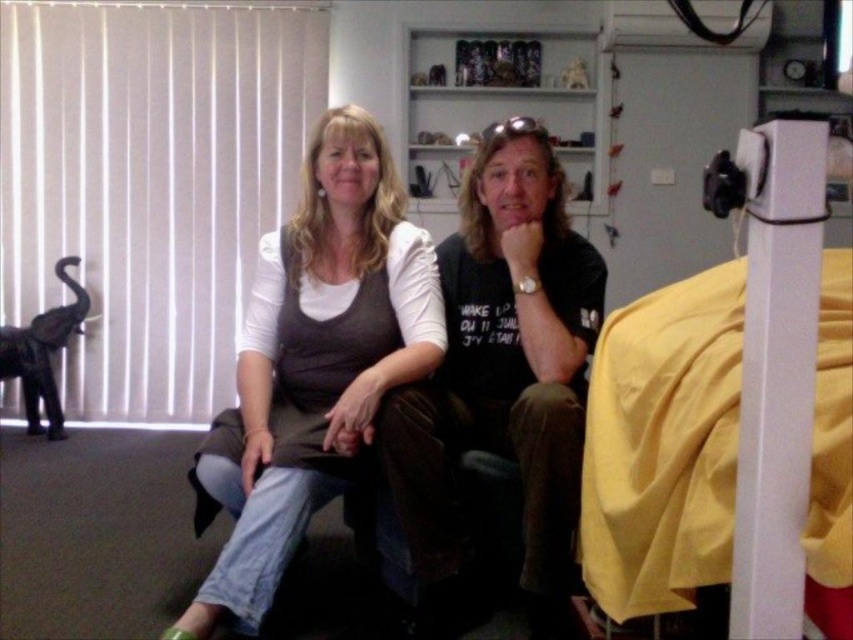
Question: Is matte gray sweater at center positioned behind matte black t-shirt at center?

Choices:
 (A) no
 (B) yes

Answer: (A)

Question: Among these points, which one is nearest to the camera?

Choices:
 (A) (517, 216)
 (B) (711, 161)

Answer: (A)

Question: Can you confirm if yellow fabric bed at right is positioned below matte gray sweater at center?

Choices:
 (A) yes
 (B) no

Answer: (B)

Question: Which point is farther to the camera?

Choices:
 (A) matte black t-shirt at center
 (B) yellow fabric bed at right

Answer: (A)

Question: From the image, what is the correct spatial relationship of yellow fabric bed at right in relation to matte black t-shirt at center?

Choices:
 (A) above
 (B) below

Answer: (A)

Question: Which point is farther from the camera taking this photo?

Choices:
 (A) (750, 234)
 (B) (306, 305)
 (C) (532, 472)

Answer: (B)